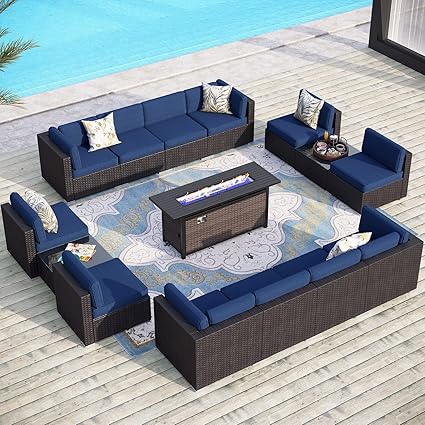
In order to click on rug in this screenshot , I will do point(142,215).